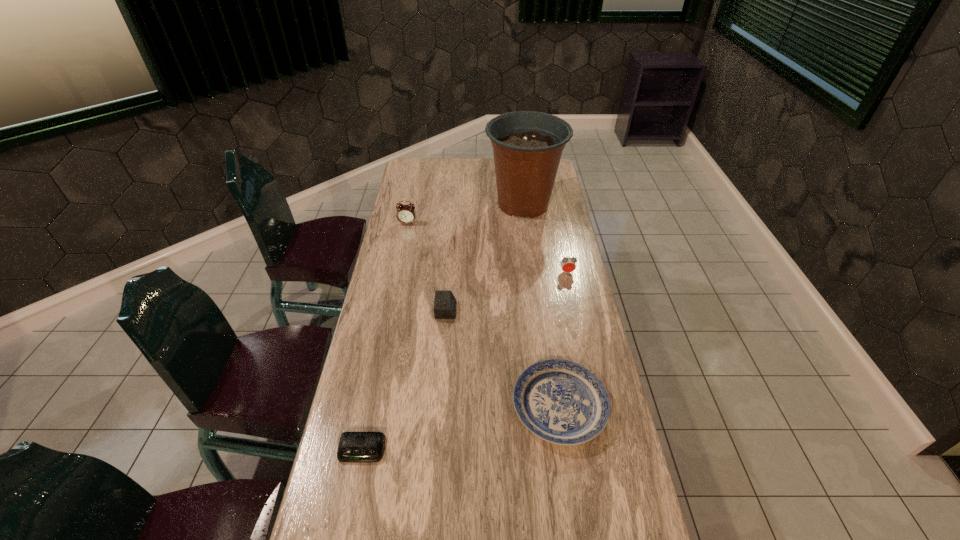
Locate an element on the screen. This screenshot has width=960, height=540. vacant region located 0.080m on the front of the flowerpot is located at coordinates click(x=528, y=239).

Where is `vacant space situated on the face of the farthest alarm clock`? The image size is (960, 540). vacant space situated on the face of the farthest alarm clock is located at coordinates (396, 285).

Locate an element on the screen. free space located 0.180m on the face of the second farthest alarm clock is located at coordinates (575, 312).

This screenshot has width=960, height=540. I want to click on free point located 0.360m on the front-facing side of the third shortest object, so click(x=564, y=310).

Locate an element on the screen. The height and width of the screenshot is (540, 960). free location located on the back of the fifth tallest object is located at coordinates (549, 335).

In order to click on blank space located 0.090m on the display of the shortest object in this screenshot , I will do `click(351, 501)`.

This screenshot has height=540, width=960. Find the location of `flowerpot located in the right edge section of the desktop`. flowerpot located in the right edge section of the desktop is located at coordinates (527, 145).

In order to click on alarm clock at the right edge in this screenshot , I will do `click(568, 265)`.

The image size is (960, 540). Find the location of `plate at the right edge`. plate at the right edge is located at coordinates (560, 401).

In the image, there is a desktop. At what (x,y) coordinates should I click in order to perform the action: click on vacant space at the far edge. Please return your answer as a coordinate pair (x, y). The width and height of the screenshot is (960, 540). Looking at the image, I should click on (485, 180).